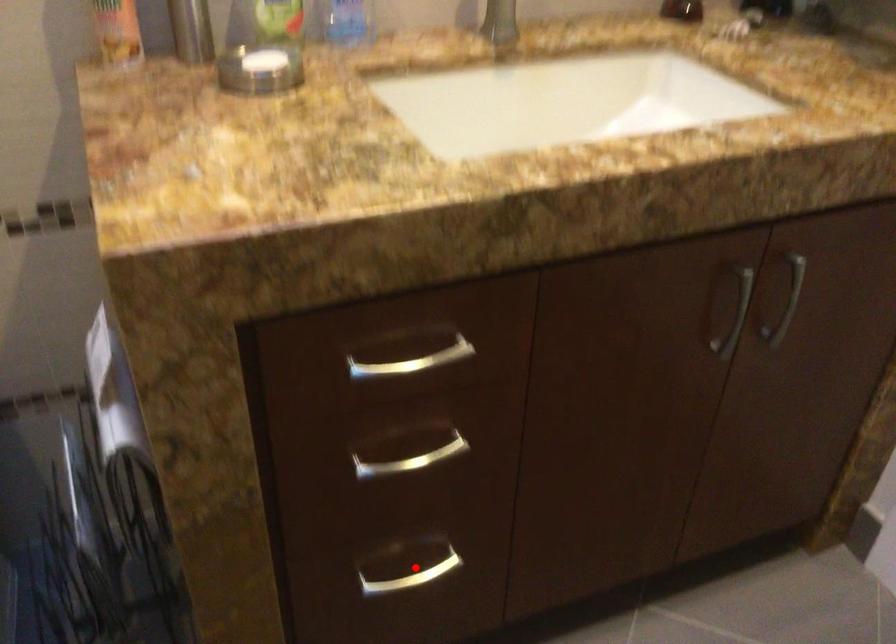
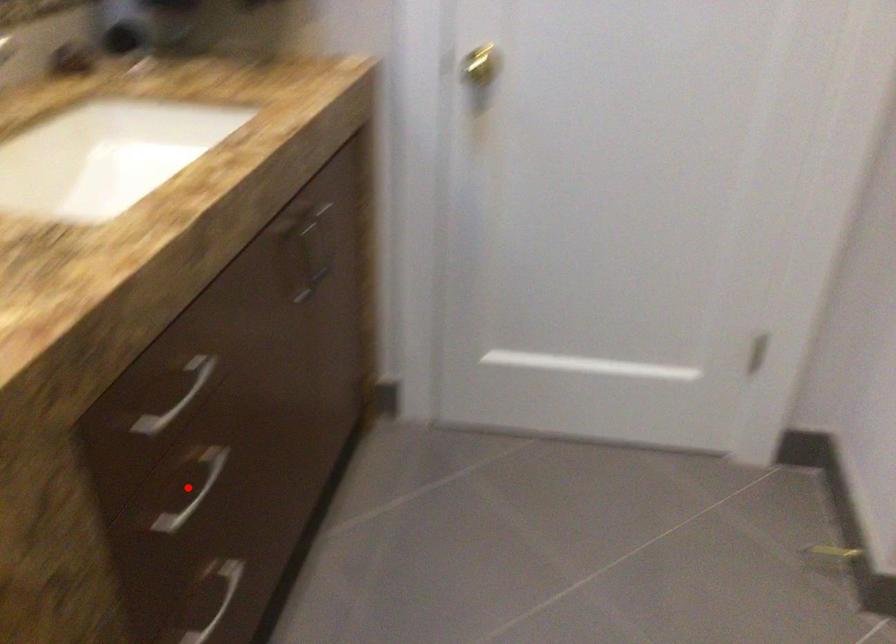
In the scene shown: I am providing you with two images of the same scene from different viewpoints. A red point is marked on the first image and another point is marked on the second image. Is the red point in image1 aligned with the point shown in image2?

No